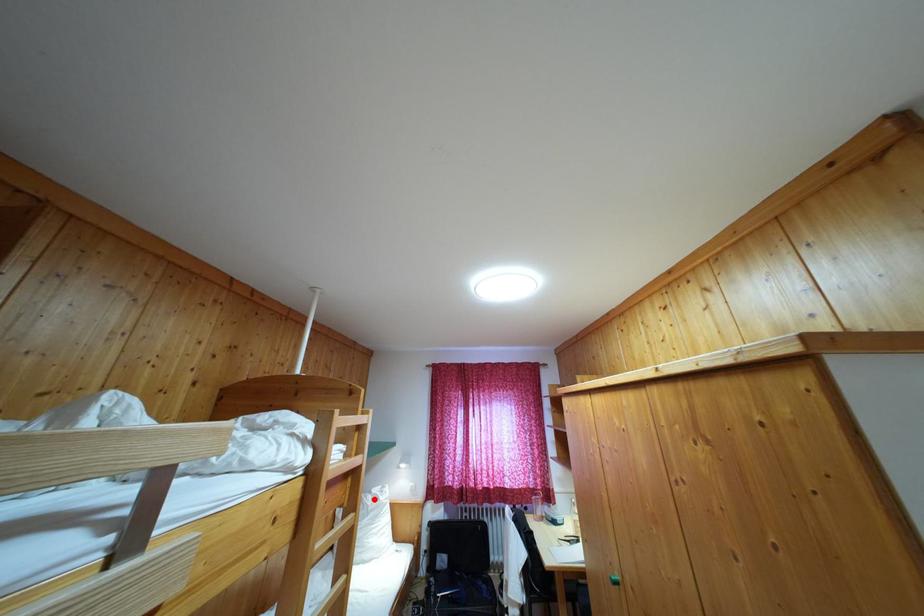
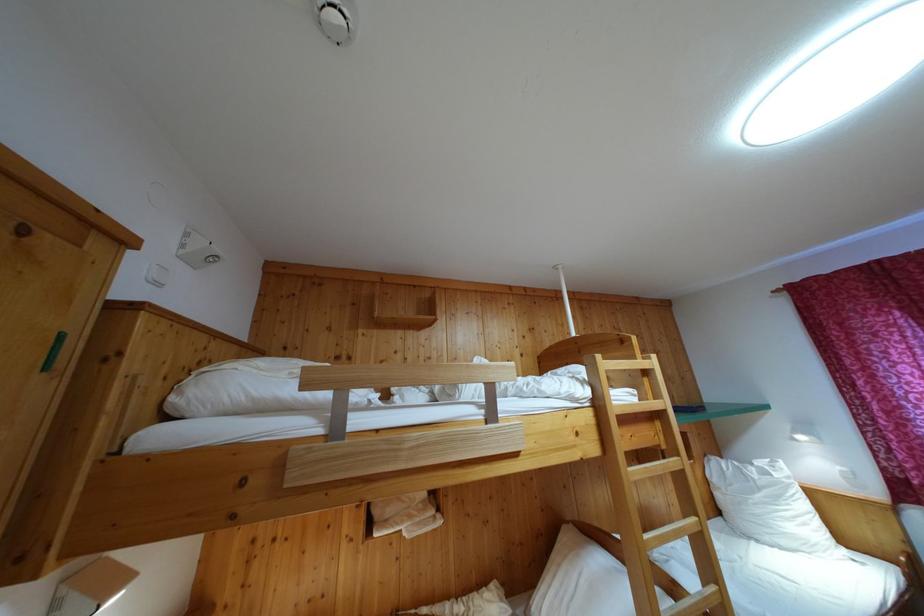
Question: A red point is marked in image1. In image2, is the corresponding 3D point closer to the camera or farther? Reply with the corresponding letter.

Choices:
 (A) The corresponding 3D point is closer.
 (B) The corresponding 3D point is farther.

Answer: (A)